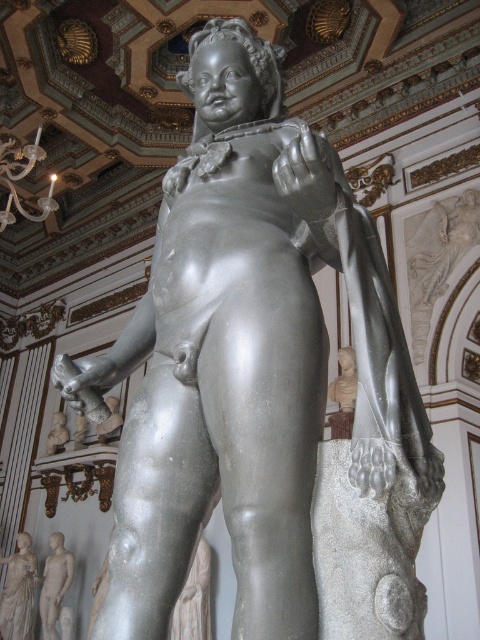
You are an art curator planning to move the smooth white statue at lower left and the gray marble statue at lower left to a new exhibition space. The new space has limited floor area. Which statue would you prioritize moving if you can only take one due to space constraints?

The smooth white statue at lower left occupies less space than the gray marble statue at lower left, so it should be prioritized for moving to the new exhibition space with limited floor area.